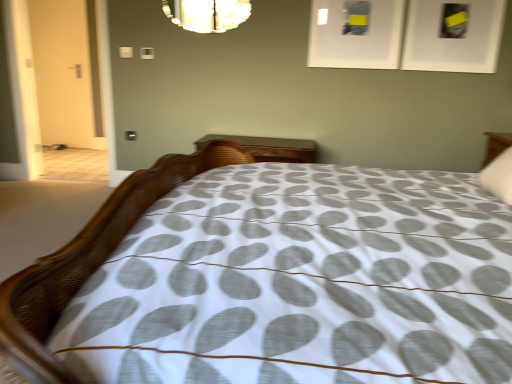
Question: Considering the positions of white matte picture frame at upper center, the 1th picture frame from the left, and white textured bed at center in the image, is white matte picture frame at upper center, the 1th picture frame from the left, taller or shorter than white textured bed at center?

Choices:
 (A) short
 (B) tall

Answer: (A)

Question: Based on their sizes in the image, would you say white matte picture frame at upper center, the 1th picture frame from the left, is bigger or smaller than white textured bed at center?

Choices:
 (A) big
 (B) small

Answer: (B)

Question: Which object is the closest to the wooden nightstand at center?

Choices:
 (A) white textured bed at center
 (B) white soft pillow at upper right
 (C) white matte door at left
 (D) white matte picture frame at upper center, the 1th picture frame from the left
 (E) white matte switch at upper center

Answer: (D)

Question: Considering the real-world distances, which object is closest to the wooden nightstand at center?

Choices:
 (A) white matte picture frame at upper center, arranged as the 2th picture frame when viewed from the right
 (B) white matte switch at upper center
 (C) white matte picture frame at upper right, positioned as the first picture frame in right-to-left order
 (D) white matte door at left
 (E) white textured bed at center

Answer: (A)